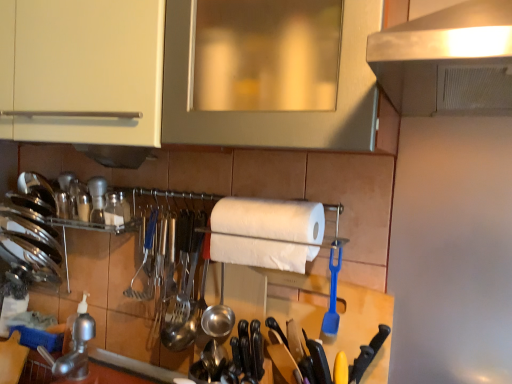
Question: Does shiny metallic utensils at center, which ranks as the third silverware in front-to-back order, appear on the left side of wooden spatula at center?

Choices:
 (A) yes
 (B) no

Answer: (A)

Question: Is shiny metallic utensils at center, acting as the third silverware starting from the right, facing towards wooden spatula at center?

Choices:
 (A) no
 (B) yes

Answer: (A)

Question: From the image's perspective, is shiny metallic utensils at center, which ranks as the third silverware in front-to-back order, below wooden spatula at center?

Choices:
 (A) no
 (B) yes

Answer: (A)

Question: Is the position of shiny metallic utensils at center, positioned as the 1th silverware in left-to-right order, less distant than that of wooden spatula at center?

Choices:
 (A) no
 (B) yes

Answer: (A)

Question: From the image's perspective, does shiny metallic utensils at center, which ranks as the third silverware in front-to-back order, appear higher than wooden spatula at center?

Choices:
 (A) no
 (B) yes

Answer: (B)

Question: Considering the relative positions of shiny metallic utensils at center, acting as the third silverware starting from the right, and wooden spatula at center in the image provided, is shiny metallic utensils at center, acting as the third silverware starting from the right, to the left or to the right of wooden spatula at center?

Choices:
 (A) right
 (B) left

Answer: (B)

Question: Is shiny metallic utensils at center, which is the first silverware in back-to-front order, inside the boundaries of wooden spatula at center, or outside?

Choices:
 (A) inside
 (B) outside

Answer: (B)

Question: Is shiny metallic utensils at center, which ranks as the third silverware in front-to-back order, wider or thinner than wooden spatula at center?

Choices:
 (A) wide
 (B) thin

Answer: (B)

Question: Is shiny metallic utensils at center, which is the first silverware in back-to-front order, taller or shorter than wooden spatula at center?

Choices:
 (A) short
 (B) tall

Answer: (B)

Question: Is point (330, 301) positioned closer to the camera than point (378, 329)?

Choices:
 (A) closer
 (B) farther

Answer: (B)

Question: From the image's perspective, is blue plastic spatula at center, acting as the second silverware starting from the back, located above or below wooden spatula at center?

Choices:
 (A) above
 (B) below

Answer: (A)

Question: Based on their sizes in the image, would you say blue plastic spatula at center, the third silverware in the left-to-right sequence, is bigger or smaller than wooden spatula at center?

Choices:
 (A) small
 (B) big

Answer: (A)

Question: Considering their positions, is blue plastic spatula at center, the third silverware in the left-to-right sequence, located in front of or behind wooden spatula at center?

Choices:
 (A) behind
 (B) front

Answer: (A)

Question: In the image, is wooden spatula at center positioned in front of or behind white matte paper towel at center?

Choices:
 (A) front
 (B) behind

Answer: (A)

Question: Considering the positions of wooden spatula at center and white matte paper towel at center in the image, is wooden spatula at center wider or thinner than white matte paper towel at center?

Choices:
 (A) wide
 (B) thin

Answer: (B)